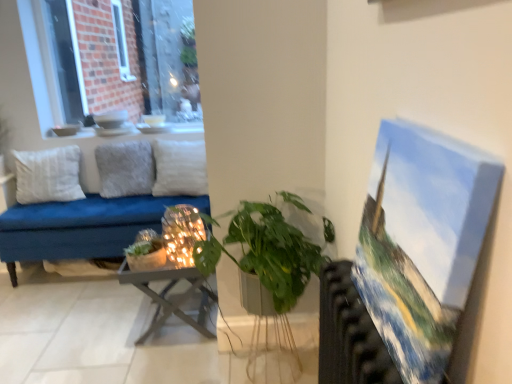
Identify the location of vacant area situated below metallic gray table at center (from a real-world perspective). The image size is (512, 384). (177, 317).